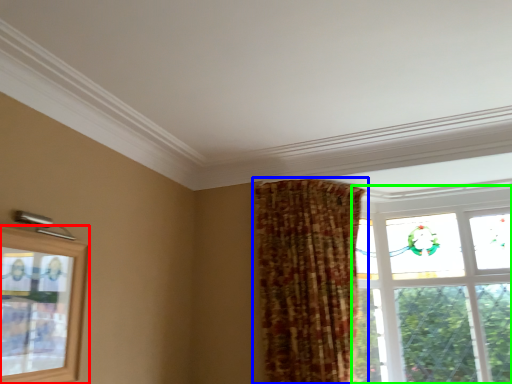
Question: Which is nearer to the window (highlighted by a red box)? curtain (highlighted by a blue box) or window (highlighted by a green box).

Choices:
 (A) curtain
 (B) window

Answer: (A)